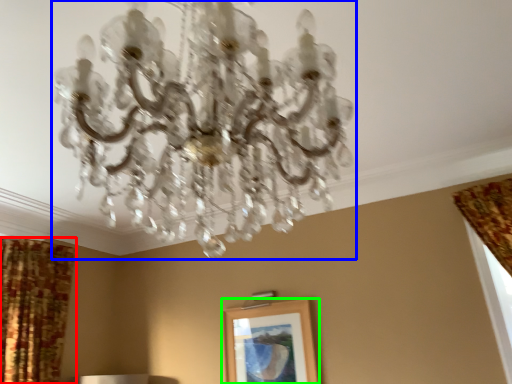
Question: Estimate the real-world distances between objects in this image. Which object is closer to curtain (highlighted by a red box), lamp (highlighted by a blue box) or picture frame (highlighted by a green box)?

Choices:
 (A) lamp
 (B) picture frame

Answer: (B)